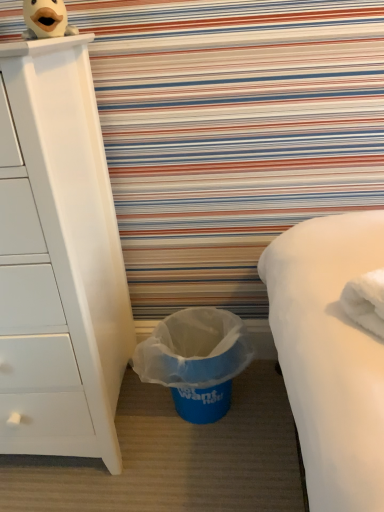
Question: From the image's perspective, is plush duck at upper left under blue plastic trash can at lower center?

Choices:
 (A) yes
 (B) no

Answer: (B)

Question: Considering the relative sizes of plush duck at upper left and blue plastic trash can at lower center in the image provided, is plush duck at upper left shorter than blue plastic trash can at lower center?

Choices:
 (A) yes
 (B) no

Answer: (A)

Question: Can you confirm if plush duck at upper left is positioned to the right of blue plastic trash can at lower center?

Choices:
 (A) no
 (B) yes

Answer: (A)

Question: Does plush duck at upper left turn towards blue plastic trash can at lower center?

Choices:
 (A) yes
 (B) no

Answer: (B)

Question: Is plush duck at upper left positioned far away from blue plastic trash can at lower center?

Choices:
 (A) yes
 (B) no

Answer: (B)

Question: In the image, is plush duck at upper left positioned in front of or behind blue plastic trash can at lower center?

Choices:
 (A) behind
 (B) front

Answer: (B)

Question: Visually, is plush duck at upper left positioned to the left or to the right of blue plastic trash can at lower center?

Choices:
 (A) right
 (B) left

Answer: (B)

Question: Is plush duck at upper left bigger or smaller than blue plastic trash can at lower center?

Choices:
 (A) big
 (B) small

Answer: (B)

Question: Is point (54, 14) closer or farther from the camera than point (155, 362)?

Choices:
 (A) farther
 (B) closer

Answer: (B)

Question: Is plush duck at upper left inside or outside of white matte chest of drawers at left?

Choices:
 (A) outside
 (B) inside

Answer: (A)

Question: Is plush duck at upper left taller or shorter than white matte chest of drawers at left?

Choices:
 (A) tall
 (B) short

Answer: (B)

Question: Does point (49, 1) appear closer or farther from the camera than point (112, 367)?

Choices:
 (A) closer
 (B) farther

Answer: (A)

Question: In the image, is plush duck at upper left on the left side or the right side of white matte chest of drawers at left?

Choices:
 (A) right
 (B) left

Answer: (A)

Question: From the image's perspective, is white matte chest of drawers at left positioned above or below blue plastic trash can at lower center?

Choices:
 (A) above
 (B) below

Answer: (A)

Question: From a real-world perspective, is white matte chest of drawers at left physically located above or below blue plastic trash can at lower center?

Choices:
 (A) below
 (B) above

Answer: (B)